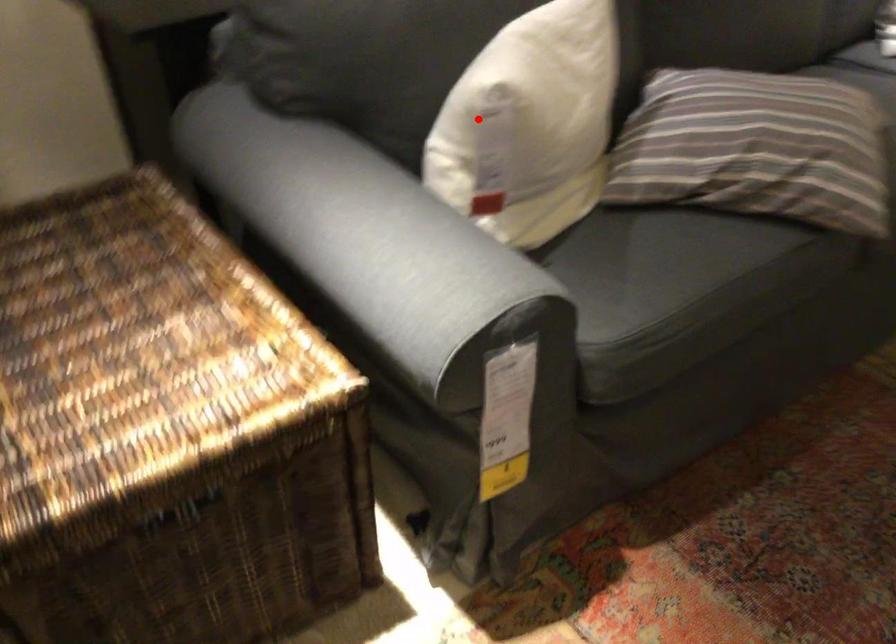
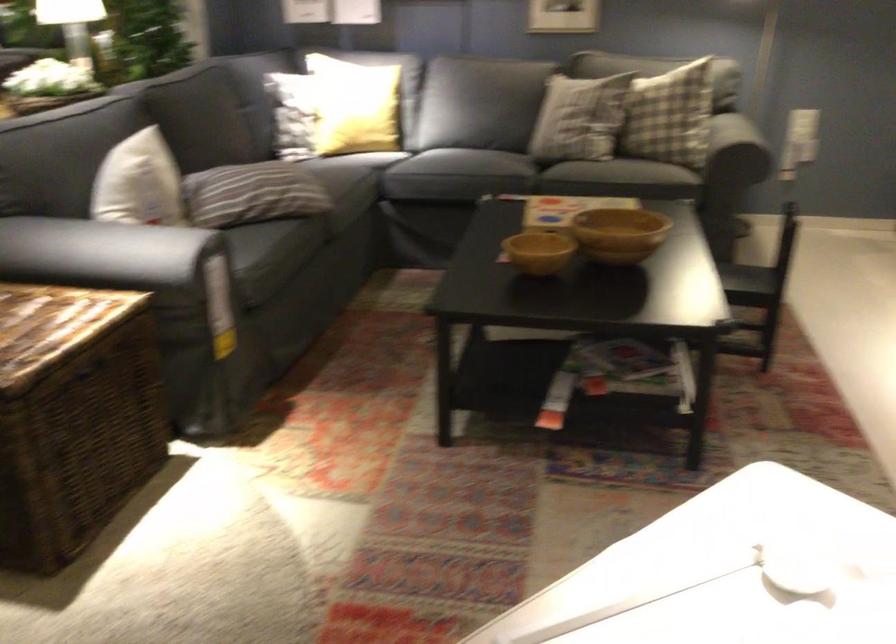
Question: I am providing you with two images of the same scene from different viewpoints. A red point is marked on the first image. Can you still see the location of the red point in image 2?

Choices:
 (A) Yes
 (B) No

Answer: (A)